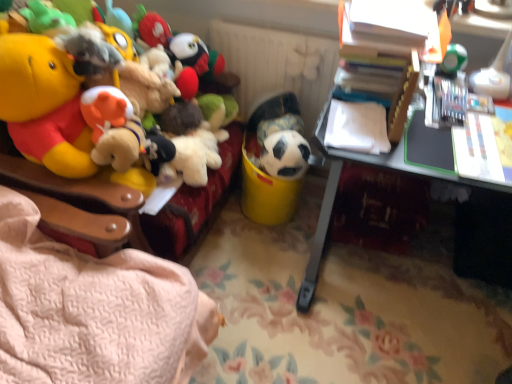
Where is `vacant point above white matte radiator at upper center (from a real-world perspective)`? Image resolution: width=512 pixels, height=384 pixels. vacant point above white matte radiator at upper center (from a real-world perspective) is located at coordinates (286, 31).